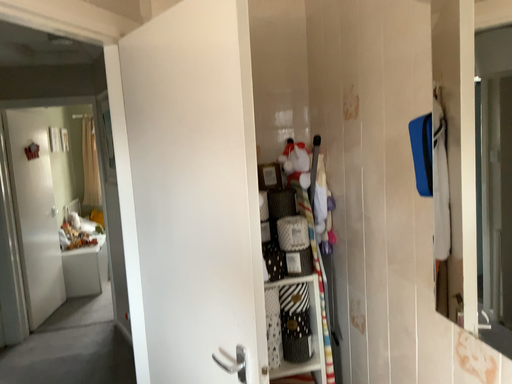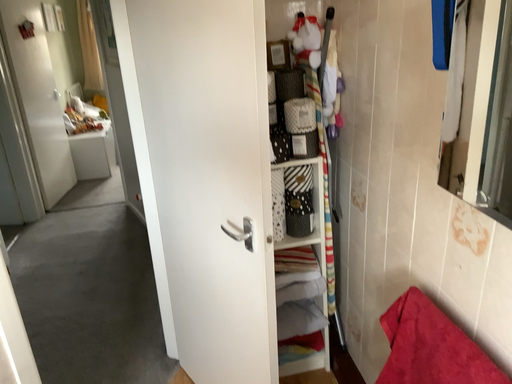
Question: Which way did the camera rotate in the video?

Choices:
 (A) rotated upward
 (B) rotated downward

Answer: (B)